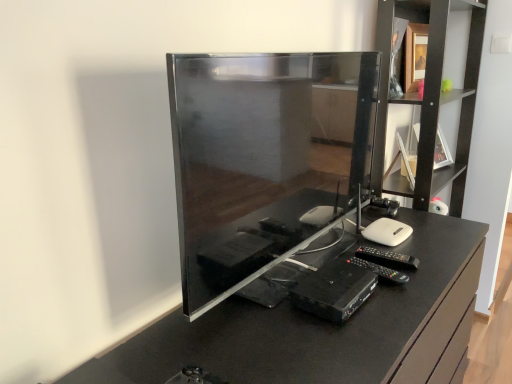
Image resolution: width=512 pixels, height=384 pixels. In order to click on empty space that is to the right of black plastic dvd player at center in this screenshot , I will do `click(408, 300)`.